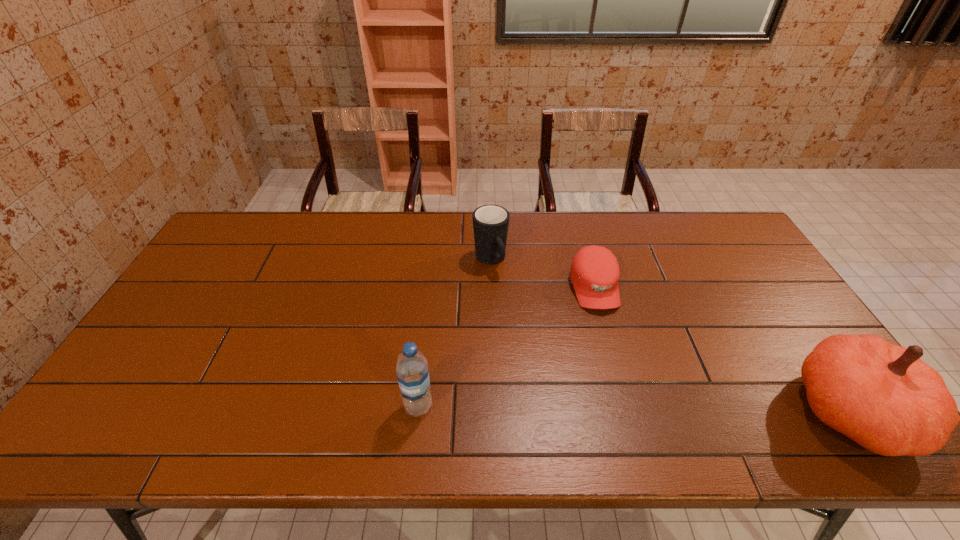
At what (x,y) coordinates should I click in order to perform the action: click on the leftmost object. Please return your answer as a coordinate pair (x, y). The height and width of the screenshot is (540, 960). Looking at the image, I should click on (412, 372).

Find the location of `the rightmost object`. the rightmost object is located at coordinates (883, 396).

The width and height of the screenshot is (960, 540). What are the coordinates of `the third object from left to right` in the screenshot? It's located at (594, 272).

Find the location of a particular element. This screenshot has height=540, width=960. the shortest object is located at coordinates (594, 272).

The width and height of the screenshot is (960, 540). What are the coordinates of `the second shortest object` in the screenshot? It's located at (490, 222).

At what (x,y) coordinates should I click in order to perform the action: click on the second object from left to right. Please return your answer as a coordinate pair (x, y). The width and height of the screenshot is (960, 540). Looking at the image, I should click on (490, 222).

This screenshot has height=540, width=960. I want to click on vacant space located 0.320m on the label of the water bottle, so click(269, 406).

The image size is (960, 540). Identify the location of free space located on the label of the water bottle. (324, 406).

Locate an element on the screen. This screenshot has width=960, height=540. free location located 0.220m on the label of the water bottle is located at coordinates (311, 406).

The image size is (960, 540). What are the coordinates of `vacant region located 0.050m on the front-facing side of the third object from left to right` in the screenshot? It's located at (607, 328).